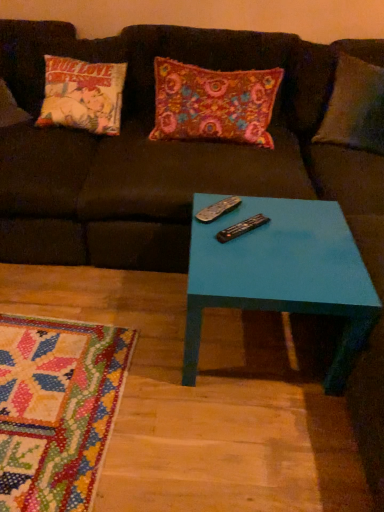
Find the location of a particular element. The height and width of the screenshot is (512, 384). free space to the back side of black plastic remote at center, which is the first remote in front-to-back order is located at coordinates (242, 208).